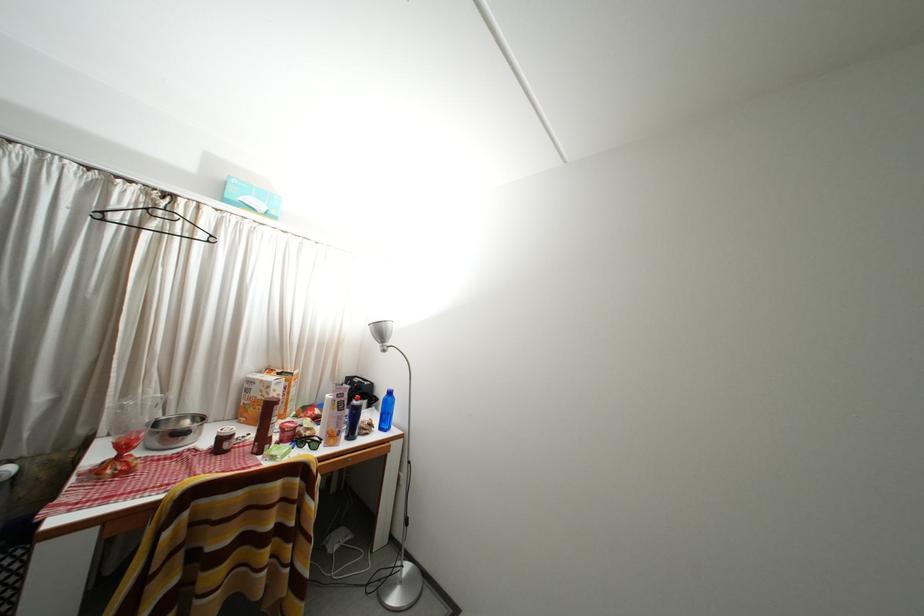
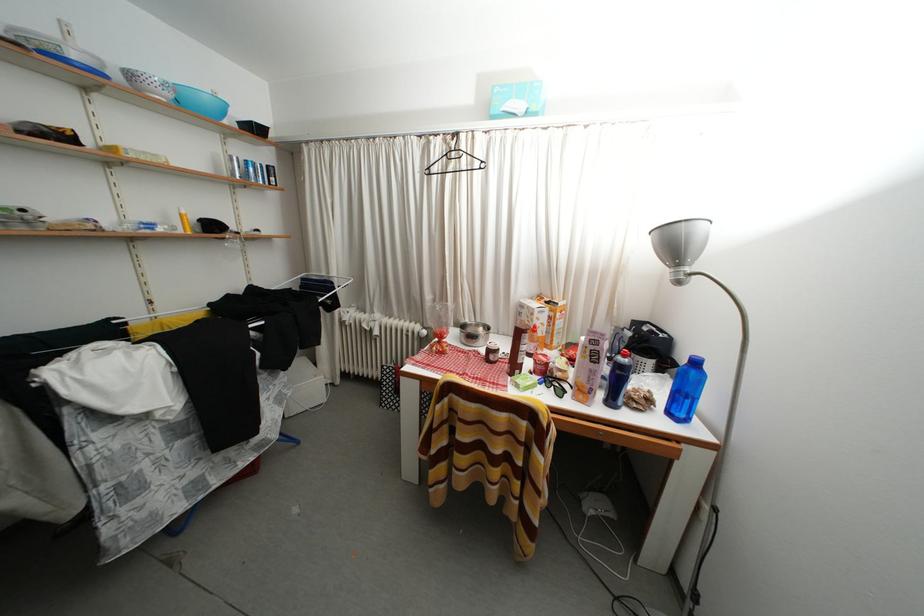
The point at [388,434] is marked in the first image. Where is the corresponding point in the second image?

(676, 419)